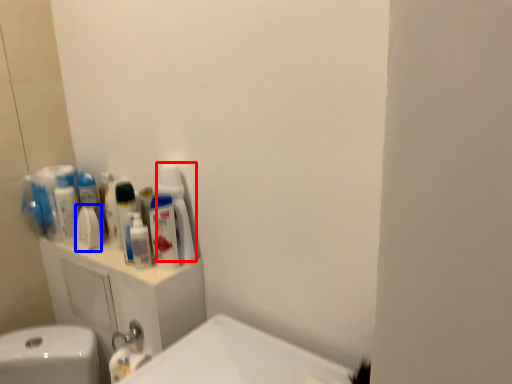
Question: Which object is further to the camera taking this photo, cleaning product (highlighted by a red box) or mouthwash (highlighted by a blue box)?

Choices:
 (A) cleaning product
 (B) mouthwash

Answer: (B)